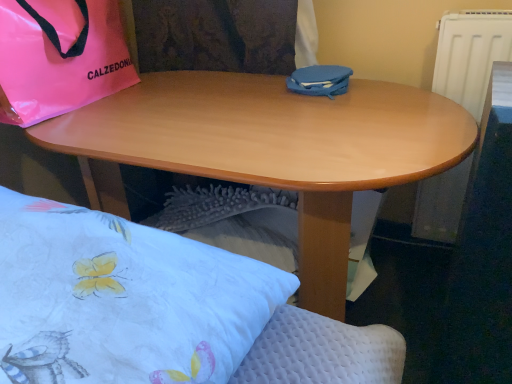
Question: Is pink glossy bag at upper left wider than blue matte case at center?

Choices:
 (A) yes
 (B) no

Answer: (B)

Question: Is blue matte case at center located within pink glossy bag at upper left?

Choices:
 (A) yes
 (B) no

Answer: (B)

Question: Could you tell me if pink glossy bag at upper left is facing blue matte case at center?

Choices:
 (A) yes
 (B) no

Answer: (A)

Question: Is there a large distance between pink glossy bag at upper left and blue matte case at center?

Choices:
 (A) yes
 (B) no

Answer: (B)

Question: Is pink glossy bag at upper left next to blue matte case at center and touching it?

Choices:
 (A) yes
 (B) no

Answer: (B)

Question: Can you confirm if pink glossy bag at upper left is bigger than blue matte case at center?

Choices:
 (A) yes
 (B) no

Answer: (A)

Question: Could you tell me if wooden desk at center is facing blue matte case at center?

Choices:
 (A) yes
 (B) no

Answer: (B)

Question: Is wooden desk at center not near blue matte case at center?

Choices:
 (A) yes
 (B) no

Answer: (B)

Question: From the image's perspective, is wooden desk at center above blue matte case at center?

Choices:
 (A) yes
 (B) no

Answer: (B)

Question: Is wooden desk at center in contact with blue matte case at center?

Choices:
 (A) no
 (B) yes

Answer: (A)

Question: From a real-world perspective, is wooden desk at center located higher than blue matte case at center?

Choices:
 (A) yes
 (B) no

Answer: (B)

Question: From a real-world perspective, is wooden desk at center below blue matte case at center?

Choices:
 (A) no
 (B) yes

Answer: (B)

Question: Is white quilted pillow at lower left in front of blue matte case at center?

Choices:
 (A) yes
 (B) no

Answer: (A)